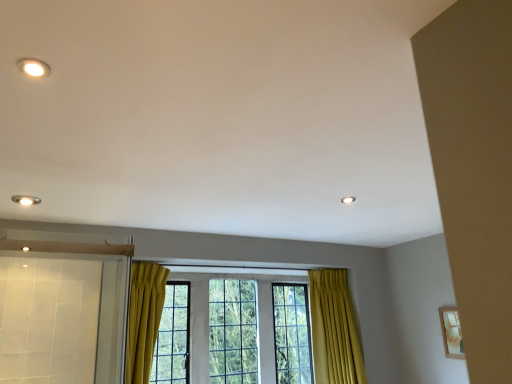
Question: Is clear glass window at center smaller than matte white light fixture at upper left?

Choices:
 (A) no
 (B) yes

Answer: (A)

Question: Is the surface of clear glass window at center in direct contact with matte white light fixture at upper left?

Choices:
 (A) no
 (B) yes

Answer: (A)

Question: Is clear glass window at center taller than matte white light fixture at upper left?

Choices:
 (A) yes
 (B) no

Answer: (A)

Question: Can you confirm if clear glass window at center is bigger than matte white light fixture at upper left?

Choices:
 (A) yes
 (B) no

Answer: (A)

Question: Does clear glass window at center appear on the left side of matte white light fixture at upper left?

Choices:
 (A) yes
 (B) no

Answer: (B)

Question: Is clear glass window at center facing away from matte white light fixture at upper left?

Choices:
 (A) yes
 (B) no

Answer: (B)

Question: Are matte white light fixture at upper left and clear glass window at center located far from each other?

Choices:
 (A) no
 (B) yes

Answer: (B)

Question: Does matte white light fixture at upper left lie behind clear glass window at center?

Choices:
 (A) yes
 (B) no

Answer: (B)

Question: Does matte white light fixture at upper left have a smaller size compared to clear glass window at center?

Choices:
 (A) no
 (B) yes

Answer: (B)

Question: Is matte white light fixture at upper left outside clear glass window at center?

Choices:
 (A) no
 (B) yes

Answer: (B)

Question: From a real-world perspective, is matte white light fixture at upper left positioned under clear glass window at center based on gravity?

Choices:
 (A) no
 (B) yes

Answer: (A)

Question: Is matte white light fixture at upper left placed right next to clear glass window at center?

Choices:
 (A) yes
 (B) no

Answer: (B)

Question: From the image's perspective, is matte white light fixture at upper left above or below clear glass window at center?

Choices:
 (A) above
 (B) below

Answer: (A)